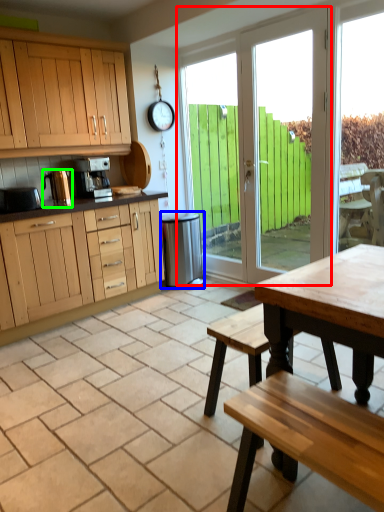
Question: Which object is the farthest from door (highlighted by a red box)? Choose among these: appliance (highlighted by a blue box) or appliance (highlighted by a green box).

Choices:
 (A) appliance
 (B) appliance

Answer: (B)